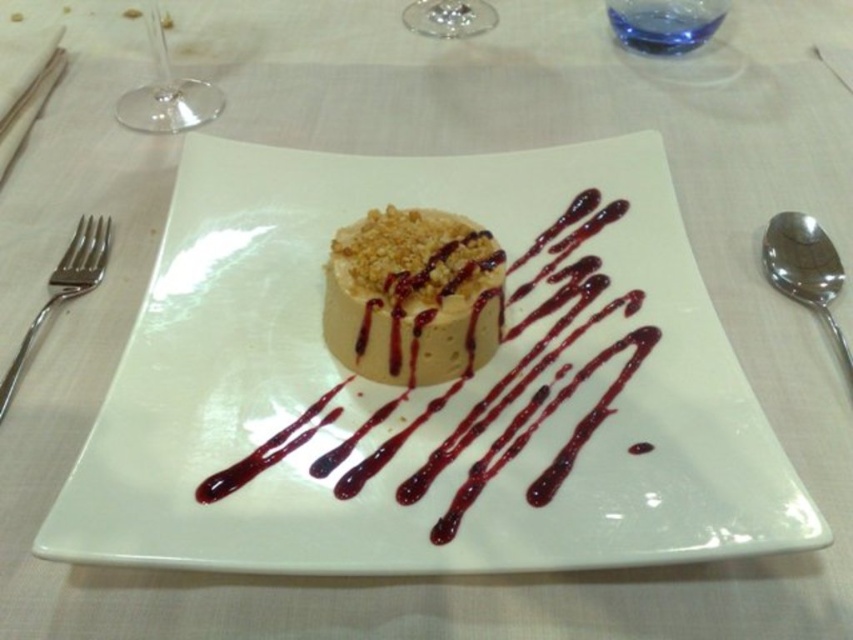
Which is below, smooth caramel cake at center or transparent glass wine glass at upper left?

smooth caramel cake at center

Is smooth caramel cake at center smaller than transparent glass wine glass at upper left?

No.

Who is more distant from viewer, (492, 262) or (184, 129)?

The point (184, 129) is behind.

Identify the location of smooth caramel cake at center. (410, 296).

Which is behind, point (518, 348) or point (360, 356)?

The point (518, 348) is behind.

Is white glossy square plate at center in front of smooth caramel cake at center?

Yes, white glossy square plate at center is closer to the viewer.

In order to click on white glossy square plate at center in this screenshot , I will do `click(399, 387)`.

Between transparent glass wine glass at upper left and transparent glass at upper center, which one appears on the right side from the viewer's perspective?

From the viewer's perspective, transparent glass at upper center appears more on the right side.

Can you confirm if transparent glass wine glass at upper left is wider than transparent glass at upper center?

No, transparent glass wine glass at upper left is not wider than transparent glass at upper center.

Between point (155, 24) and point (473, 12), which one is positioned in front?

Positioned in front is point (155, 24).

Find the location of a particular element. This screenshot has width=853, height=640. transparent glass wine glass at upper left is located at coordinates (166, 92).